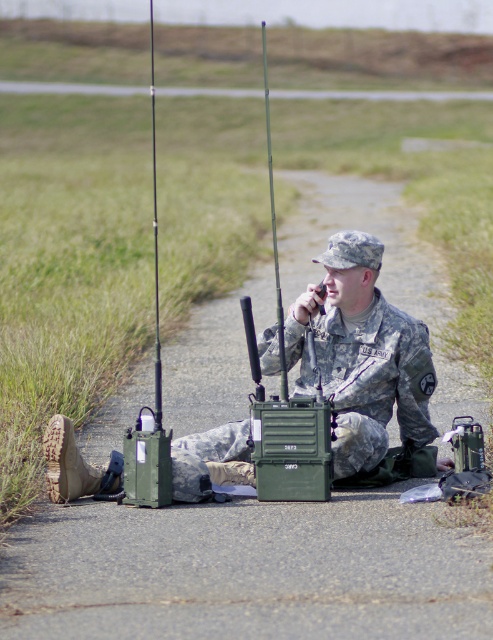
Between camouflage fabric uniform at center and green plastic fishing pole at center, which one is positioned lower?

camouflage fabric uniform at center is lower down.

Is camouflage fabric uniform at center in front of green plastic fishing pole at center?

No.

Where is `camouflage fabric uniform at center`? This screenshot has height=640, width=493. camouflage fabric uniform at center is located at coordinates (361, 355).

Locate an element on the screen. The height and width of the screenshot is (640, 493). camouflage fabric uniform at center is located at coordinates (361, 355).

Does camouflage fabric uniform at center appear under metallic silver pole at center?

Yes, camouflage fabric uniform at center is below metallic silver pole at center.

The width and height of the screenshot is (493, 640). What do you see at coordinates (361, 355) in the screenshot?
I see `camouflage fabric uniform at center` at bounding box center [361, 355].

Is point (374, 362) more distant than point (262, 45)?

No, it is in front of (262, 45).

Locate an element on the screen. The image size is (493, 640). camouflage fabric uniform at center is located at coordinates (361, 355).

How far apart are metallic silver pole at center and green plastic fishing pole at center?

The distance of metallic silver pole at center from green plastic fishing pole at center is 11.11 feet.

Is point (277, 273) less distant than point (153, 132)?

Yes, it is.

At what (x,y) coordinates should I click in order to perform the action: click on metallic silver pole at center. Please return your answer as a coordinate pair (x, y). Looking at the image, I should click on click(275, 234).